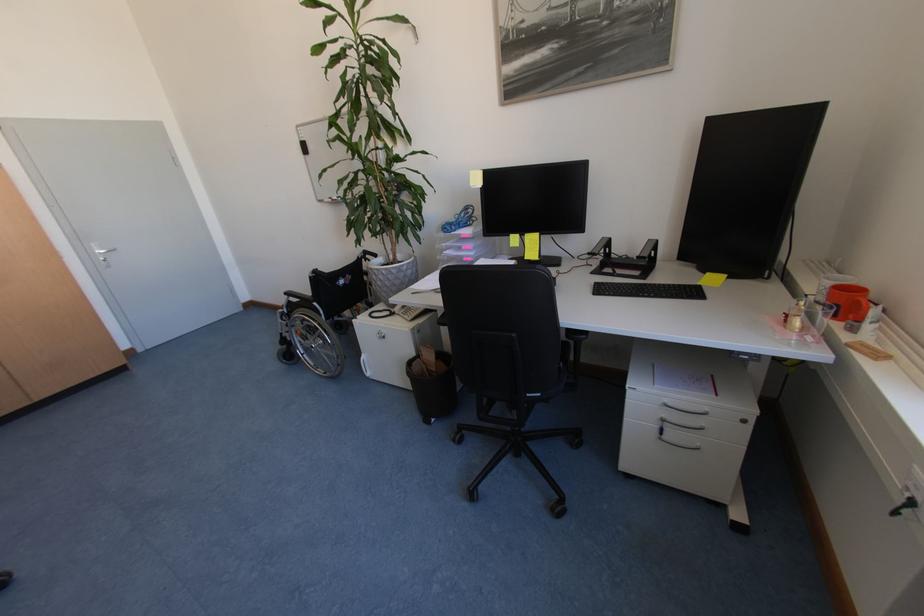
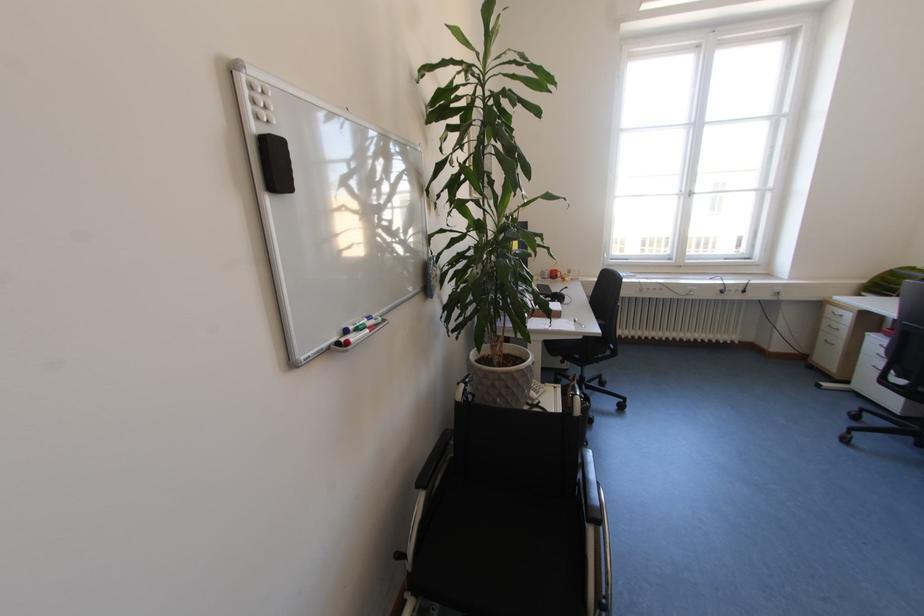
Find the pixel in the second image that matches (x=824, y=300) in the first image.

(553, 278)